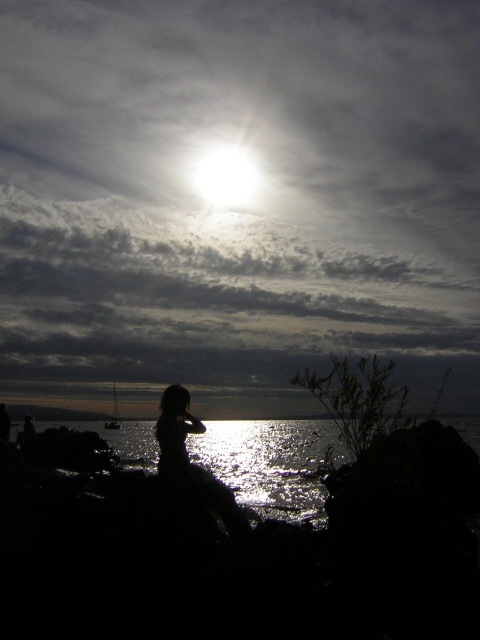
Question: Is glistening reflective water at lower center wider than bright white light at upper center?

Choices:
 (A) yes
 (B) no

Answer: (A)

Question: Which is nearer to the glistening reflective water at lower center?

Choices:
 (A) bright white light at upper center
 (B) silhouette dress at center

Answer: (B)

Question: Based on their relative distances, which object is nearer to the silhouette dress at center?

Choices:
 (A) glistening reflective water at lower center
 (B) bright white light at upper center

Answer: (A)

Question: Does glistening reflective water at lower center appear over bright white light at upper center?

Choices:
 (A) no
 (B) yes

Answer: (A)

Question: Which of the following is the farthest from the observer?

Choices:
 (A) silhouette dress at center
 (B) glistening reflective water at lower center
 (C) bright white light at upper center

Answer: (C)

Question: Is silhouette dress at center wider than bright white light at upper center?

Choices:
 (A) yes
 (B) no

Answer: (A)